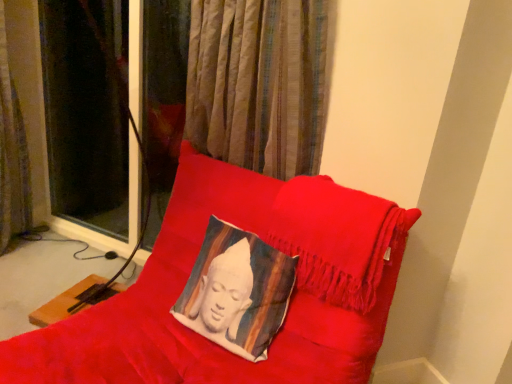
Locate an element on the screen. This screenshot has width=512, height=384. silky white cushion at center is located at coordinates pyautogui.click(x=237, y=291).

The width and height of the screenshot is (512, 384). Describe the element at coordinates (190, 272) in the screenshot. I see `velvet cushion at center` at that location.

The width and height of the screenshot is (512, 384). Identify the location of brown textured curtain at left. (87, 110).

Find the location of a particular element. silky white cushion at center is located at coordinates (237, 291).

Is brown textured curtain at left inside the boundaries of silky white cushion at center, or outside?

brown textured curtain at left cannot be found inside silky white cushion at center.

Which point is more distant from viewer, (59, 148) or (243, 350)?

Positioned behind is point (59, 148).

At what (x,y) coordinates should I click in order to perform the action: click on curtain behind the silky white cushion at center. Please return your answer as a coordinate pair (x, y). Looking at the image, I should click on (87, 110).

Where is `furniture that appears in front of the brown textured curtain at left`? This screenshot has height=384, width=512. furniture that appears in front of the brown textured curtain at left is located at coordinates (190, 272).

Consider the image. Would you say velvet cushion at center is outside brown textured curtain at left?

velvet cushion at center lies outside brown textured curtain at left's area.

Is velvet cushion at center next to brown textured curtain at left and touching it?

No, velvet cushion at center is not making contact with brown textured curtain at left.

Can you confirm if velvet cushion at center is positioned to the left of brown textured curtain at left?

No.

How far apart are silky white cushion at center and brown textured curtain at left?

silky white cushion at center is 4.71 feet from brown textured curtain at left.

Is point (202, 255) positioned behind point (54, 116)?

No, (202, 255) is in front of (54, 116).

Looking at this image, which object is further away from the camera, silky white cushion at center or brown textured curtain at left?

brown textured curtain at left is more distant.

Considering the relative sizes of brown textured curtain at left and velvet cushion at center in the image provided, is brown textured curtain at left thinner than velvet cushion at center?

Yes.

Is brown textured curtain at left aimed at velvet cushion at center?

No, brown textured curtain at left does not turn towards velvet cushion at center.

Looking at this image, considering the positions of objects brown textured curtain at left and velvet cushion at center in the image provided, who is in front, brown textured curtain at left or velvet cushion at center?

Positioned in front is velvet cushion at center.

Between velvet cushion at center and silky white cushion at center, which one appears on the right side from the viewer's perspective?

silky white cushion at center is more to the right.

Which object is more forward, velvet cushion at center or silky white cushion at center?

velvet cushion at center is closer to the camera.

From the picture: Is velvet cushion at center situated inside silky white cushion at center or outside?

velvet cushion at center is not inside silky white cushion at center, it's outside.

Considering the sizes of objects silky white cushion at center and velvet cushion at center in the image provided, who is taller, silky white cushion at center or velvet cushion at center?

Standing taller between the two is velvet cushion at center.

What's the angular difference between silky white cushion at center and velvet cushion at center's facing directions?

1.74 degrees separate the facing orientations of silky white cushion at center and velvet cushion at center.

From the image's perspective, would you say silky white cushion at center is shown under velvet cushion at center?

No, from the image's perspective, silky white cushion at center is not beneath velvet cushion at center.

Between silky white cushion at center and velvet cushion at center, which one has smaller size?

silky white cushion at center is smaller.

Where is `pillow below the brown textured curtain at left (from a real-world perspective)`? The image size is (512, 384). pillow below the brown textured curtain at left (from a real-world perspective) is located at coordinates (237, 291).

Identify the location of furniture that appears below the brown textured curtain at left (from the image's perspective). (190, 272).

When comparing their distances from brown textured curtain at left, does silky white cushion at center or velvet cushion at center seem closer?

velvet cushion at center is closer to brown textured curtain at left.

Estimate the real-world distances between objects in this image. Which object is further from brown textured curtain at left, velvet cushion at center or silky white cushion at center?

The object further to brown textured curtain at left is silky white cushion at center.

Estimate the real-world distances between objects in this image. Which object is closer to silky white cushion at center, brown textured curtain at left or velvet cushion at center?

Among the two, velvet cushion at center is located nearer to silky white cushion at center.

From the image, which object appears to be nearer to velvet cushion at center, silky white cushion at center or brown textured curtain at left?

silky white cushion at center is positioned closer to the anchor velvet cushion at center.

From the image, which object appears to be nearer to silky white cushion at center, velvet cushion at center or brown textured curtain at left?

The object closer to silky white cushion at center is velvet cushion at center.

Estimate the real-world distances between objects in this image. Which object is closer to velvet cushion at center, brown textured curtain at left or silky white cushion at center?

silky white cushion at center.

I want to click on pillow between velvet cushion at center and brown textured curtain at left along the z-axis, so click(237, 291).